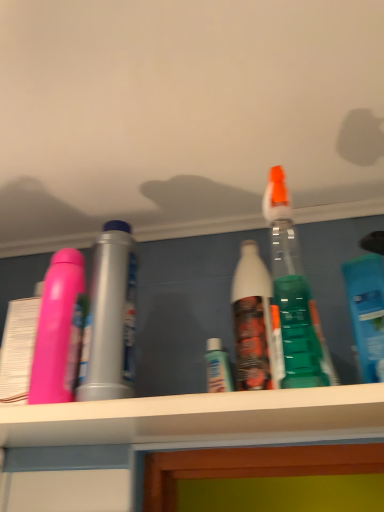
Question: Considering the positions of blue translucent bottle at right, the 1th bottle positioned from the right, and pink matte bottle at left, the 2th bottle in the right-to-left sequence, in the image, is blue translucent bottle at right, the 1th bottle positioned from the right, taller or shorter than pink matte bottle at left, the 2th bottle in the right-to-left sequence,?

Choices:
 (A) tall
 (B) short

Answer: (B)

Question: Considering their positions, is blue translucent bottle at right, the 1th bottle positioned from the right, located in front of or behind pink matte bottle at left, the 1th bottle when ordered from left to right?

Choices:
 (A) front
 (B) behind

Answer: (A)

Question: From the image's perspective, is blue translucent bottle at right, the second bottle from the left, above or below pink matte bottle at left, the 2th bottle in the right-to-left sequence?

Choices:
 (A) above
 (B) below

Answer: (A)

Question: Is pink matte bottle at left, the 2th bottle in the right-to-left sequence, in front of or behind blue translucent bottle at right, the 1th bottle positioned from the right, in the image?

Choices:
 (A) behind
 (B) front

Answer: (A)

Question: From a real-world perspective, is pink matte bottle at left, the 1th bottle when ordered from left to right, physically located above or below blue translucent bottle at right, the 1th bottle positioned from the right?

Choices:
 (A) above
 (B) below

Answer: (A)

Question: Visually, is pink matte bottle at left, the 1th bottle when ordered from left to right, positioned to the left or to the right of blue translucent bottle at right, the 1th bottle positioned from the right?

Choices:
 (A) left
 (B) right

Answer: (A)

Question: Considering the positions of point (112, 267) and point (370, 289), is point (112, 267) closer or farther from the camera than point (370, 289)?

Choices:
 (A) farther
 (B) closer

Answer: (B)